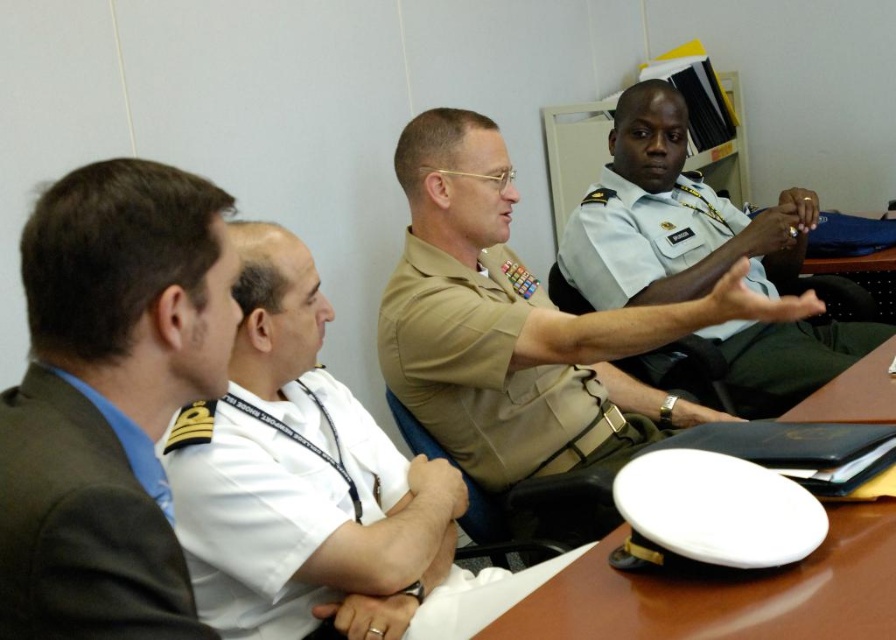
Question: Observing the image, what is the correct spatial positioning of white matte hat at center in reference to light blue uniform at center?

Choices:
 (A) below
 (B) above

Answer: (A)

Question: Estimate the real-world distances between objects in this image. Which object is farther from the tan uniform at center?

Choices:
 (A) black fabric uniform at left
 (B) white matte hat at center
 (C) light blue uniform at center
 (D) white uniform at center

Answer: (A)

Question: In this image, where is tan uniform at center located relative to white matte hat at center?

Choices:
 (A) left
 (B) right

Answer: (A)

Question: Which of the following is the farthest from the observer?

Choices:
 (A) white matte hat at center
 (B) black fabric uniform at left
 (C) white uniform at center
 (D) light blue uniform at center

Answer: (D)

Question: Among these points, which one is farthest from the camera?

Choices:
 (A) (50, 417)
 (B) (761, 324)
 (C) (578, 579)

Answer: (B)

Question: Considering the relative positions of white matte hat at center and light blue uniform at center in the image provided, where is white matte hat at center located with respect to light blue uniform at center?

Choices:
 (A) above
 (B) below

Answer: (B)